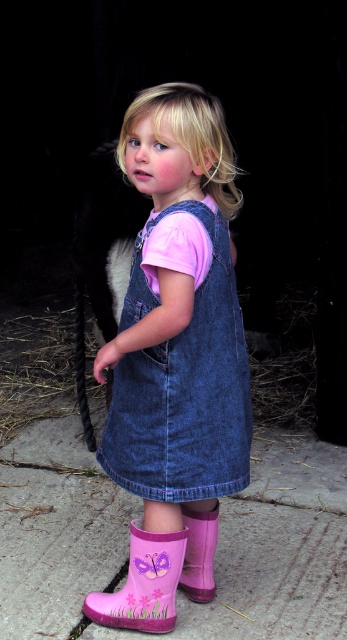
You are a photographer setting up for a photo shoot in the rural area shown. You have two markers placed at coordinates point (131, 577) and point (188, 541). Which marker is closer to the camera based on their positions?

Point (131, 577) is in front of point (188, 541), so it is closer to the camera.